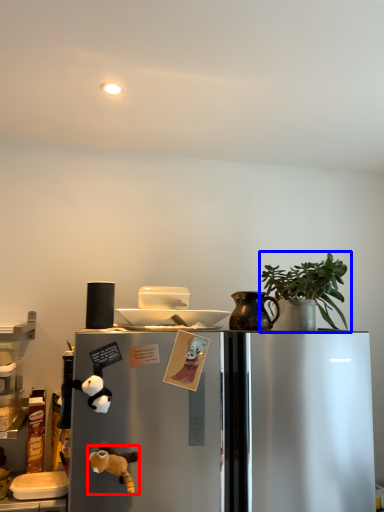
Question: Which object is closer to the camera taking this photo, toy (highlighted by a red box) or houseplant (highlighted by a blue box)?

Choices:
 (A) toy
 (B) houseplant

Answer: (A)